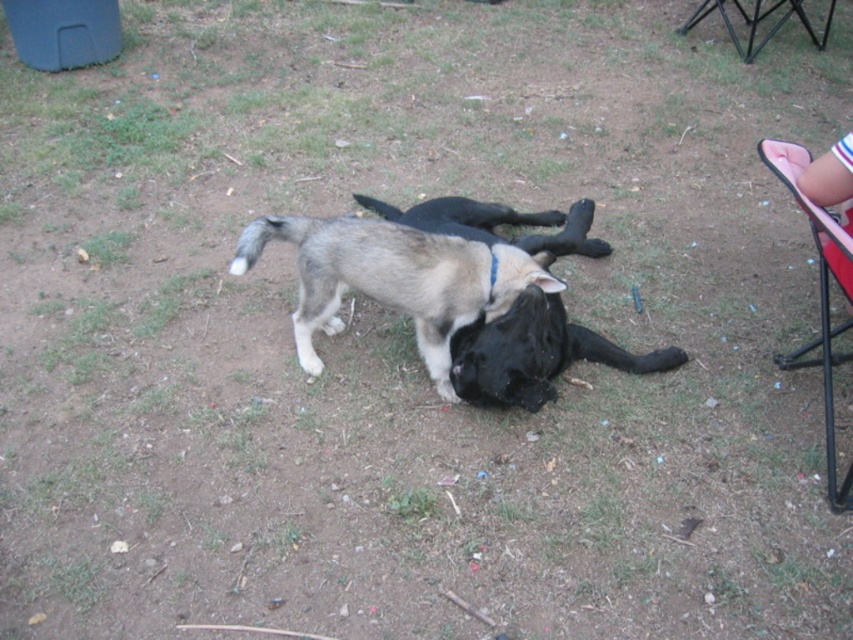
Which of these two, pink fabric chair at right or black metal chair at upper right, stands shorter?

With less height is pink fabric chair at right.

The width and height of the screenshot is (853, 640). I want to click on pink fabric chair at right, so click(819, 296).

Does black matte dog at center come behind pink fabric chair at right?

Yes.

The width and height of the screenshot is (853, 640). What are the coordinates of `black matte dog at center` in the screenshot? It's located at (535, 353).

Locate an element on the screen. black matte dog at center is located at coordinates (535, 353).

Describe the element at coordinates (393, 280) in the screenshot. Image resolution: width=853 pixels, height=640 pixels. I see `gray fur dog at center` at that location.

Is point (351, 269) farther from camera compared to point (828, 8)?

No, (351, 269) is closer to viewer.

This screenshot has width=853, height=640. I want to click on gray fur dog at center, so click(x=393, y=280).

Locate an element on the screen. gray fur dog at center is located at coordinates (393, 280).